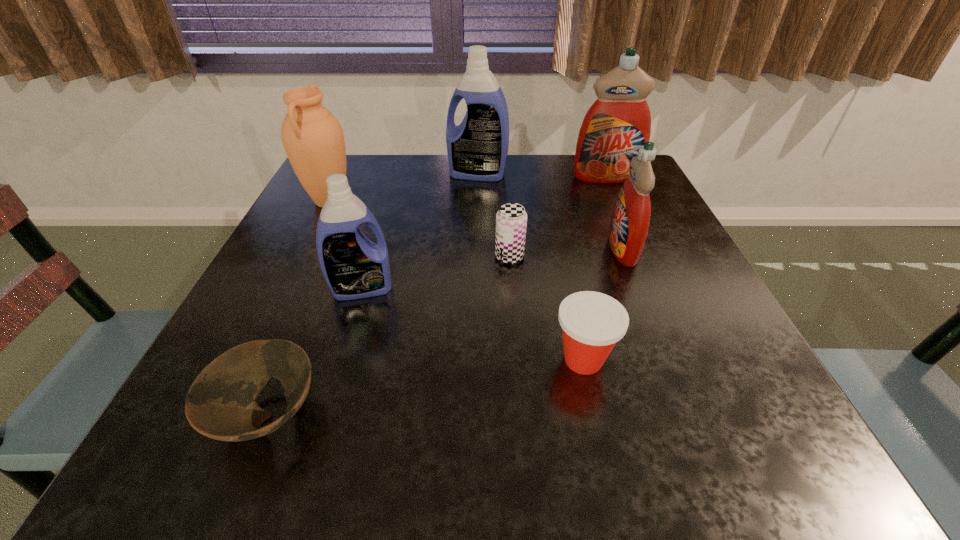
I want to click on detergent that is the third closest to the second detergent from left to right, so click(x=354, y=267).